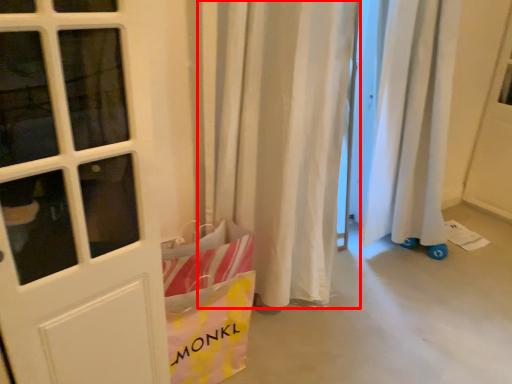
Question: From the image's perspective, where is curtain (annotated by the red box) located in relation to grocery bag in the image?

Choices:
 (A) above
 (B) below

Answer: (A)